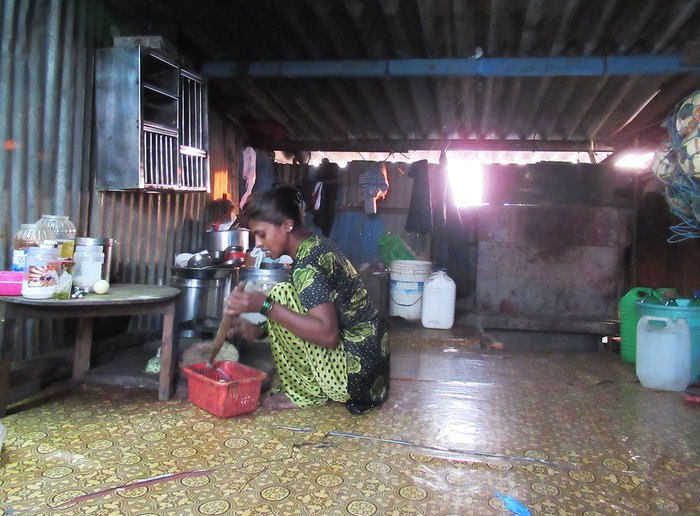
The height and width of the screenshot is (516, 700). In order to click on red basket in this screenshot , I will do `click(220, 396)`.